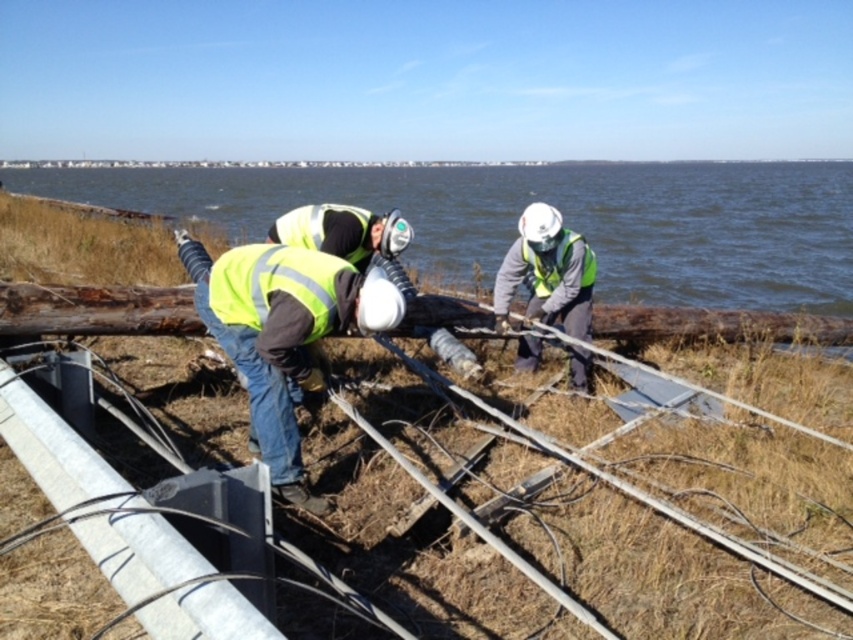
Question: Among these objects, which one is farthest from the camera?

Choices:
 (A) reflective yellow safety vest at center
 (B) blue water at center

Answer: (A)

Question: Where is blue water at center located in relation to reflective yellow safety vest at center in the image?

Choices:
 (A) right
 (B) left

Answer: (A)

Question: Which of the following is the closest to the observer?

Choices:
 (A) (833, 221)
 (B) (581, 237)

Answer: (B)

Question: Is blue water at center behind reflective yellow safety vest at center?

Choices:
 (A) no
 (B) yes

Answer: (A)

Question: Is blue water at center wider than reflective yellow safety vest at center?

Choices:
 (A) no
 (B) yes

Answer: (B)